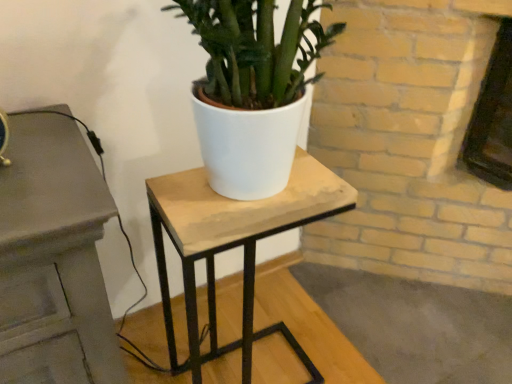
This screenshot has height=384, width=512. What do you see at coordinates (234, 246) in the screenshot?
I see `wooden table at center` at bounding box center [234, 246].

Where is `wooden table at center`? The height and width of the screenshot is (384, 512). wooden table at center is located at coordinates point(234,246).

Image resolution: width=512 pixels, height=384 pixels. Describe the element at coordinates (252, 90) in the screenshot. I see `white matte pot at center` at that location.

Locate an element on the screen. This screenshot has width=512, height=384. white matte pot at center is located at coordinates [x=252, y=90].

At what (x,y) coordinates should I click in order to perform the action: click on wooden table at center. Please return your answer as a coordinate pair (x, y). The image size is (512, 384). Looking at the image, I should click on (234, 246).

Is wooden table at center to the right of white matte pot at center from the viewer's perspective?

No.

From the picture: Which is in front, wooden table at center or white matte pot at center?

white matte pot at center.

Considering the positions of point (247, 285) and point (224, 168), is point (247, 285) closer or farther from the camera than point (224, 168)?

Clearly, point (247, 285) is more distant from the camera than point (224, 168).

From the image's perspective, is wooden table at center above or below white matte pot at center?

From the image's perspective, wooden table at center appears below white matte pot at center.

From a real-world perspective, between wooden table at center and white matte pot at center, who is vertically lower?

wooden table at center is physically lower.

Between wooden table at center and white matte pot at center, which one has smaller width?

With smaller width is white matte pot at center.

Considering the relative sizes of wooden table at center and white matte pot at center in the image provided, is wooden table at center shorter than white matte pot at center?

In fact, wooden table at center may be taller than white matte pot at center.

Which of these two, wooden table at center or white matte pot at center, is smaller?

With smaller size is white matte pot at center.

Is wooden table at center inside the boundaries of white matte pot at center, or outside?

wooden table at center lies outside white matte pot at center.

Would you consider wooden table at center to be distant from white matte pot at center?

No, wooden table at center is not far from white matte pot at center.

Is wooden table at center positioned with its back to white matte pot at center?

No, wooden table at center is not facing away from white matte pot at center.

How much distance is there between wooden table at center and white matte pot at center?

wooden table at center is 22.00 inches away from white matte pot at center.

This screenshot has height=384, width=512. I want to click on houseplant above the wooden table at center (from a real-world perspective), so click(252, 90).

Is white matte pot at center to the left or to the right of wooden table at center in the image?

From the image, it's evident that white matte pot at center is to the right of wooden table at center.

Is white matte pot at center positioned behind wooden table at center?

No, white matte pot at center is closer to the camera.

Is point (266, 39) less distant than point (298, 200)?

Yes, point (266, 39) is closer to viewer.

From the image's perspective, does white matte pot at center appear higher than wooden table at center?

Yes.

From a real-world perspective, which is physically below, white matte pot at center or wooden table at center?

wooden table at center, from a real-world perspective.

Does white matte pot at center have a lesser width compared to wooden table at center?

Yes, white matte pot at center is thinner than wooden table at center.

Between white matte pot at center and wooden table at center, which one has less height?

white matte pot at center.

Looking at the image, does white matte pot at center seem bigger or smaller compared to wooden table at center?

Considering their sizes, white matte pot at center takes up less space than wooden table at center.

Would you say white matte pot at center is inside or outside wooden table at center?

white matte pot at center lies outside wooden table at center.

Would you say white matte pot at center is a long distance from wooden table at center?

No, white matte pot at center is in close proximity to wooden table at center.

Does white matte pot at center turn towards wooden table at center?

No, white matte pot at center is not facing towards wooden table at center.

Can you tell me how much white matte pot at center and wooden table at center differ in facing direction?

There is a 1.4-degree angle between the facing directions of white matte pot at center and wooden table at center.

The width and height of the screenshot is (512, 384). In order to click on table below the white matte pot at center (from a real-world perspective) in this screenshot , I will do `click(234, 246)`.

The height and width of the screenshot is (384, 512). Identify the location of table on the left of the white matte pot at center. (234, 246).

Identify the location of houseplant that appears above the wooden table at center (from the image's perspective). (252, 90).